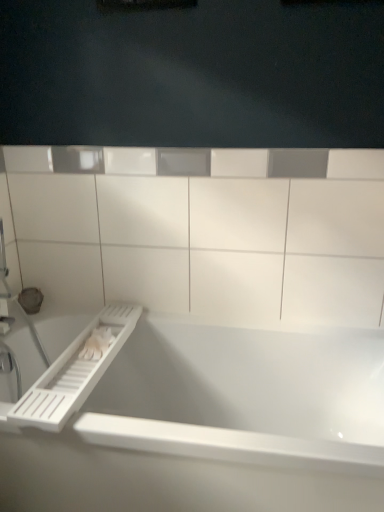
Question: Does white glossy bathtub at center turn towards white plastic ledge at upper center?

Choices:
 (A) no
 (B) yes

Answer: (A)

Question: Is white glossy bathtub at center turned away from white plastic ledge at upper center?

Choices:
 (A) yes
 (B) no

Answer: (B)

Question: Considering the relative positions of white glossy bathtub at center and white plastic ledge at upper center in the image provided, is white glossy bathtub at center to the left of white plastic ledge at upper center from the viewer's perspective?

Choices:
 (A) no
 (B) yes

Answer: (B)

Question: Considering the relative positions of white glossy bathtub at center and white plastic ledge at upper center in the image provided, is white glossy bathtub at center behind white plastic ledge at upper center?

Choices:
 (A) yes
 (B) no

Answer: (B)

Question: Considering the relative sizes of white glossy bathtub at center and white plastic ledge at upper center in the image provided, is white glossy bathtub at center smaller than white plastic ledge at upper center?

Choices:
 (A) no
 (B) yes

Answer: (A)

Question: Is white plastic ledge at upper center wider or thinner than white plastic towel bar at lower left?

Choices:
 (A) thin
 (B) wide

Answer: (A)

Question: Considering the positions of point click(x=292, y=229) and point click(x=56, y=410), is point click(x=292, y=229) closer or farther from the camera than point click(x=56, y=410)?

Choices:
 (A) closer
 (B) farther

Answer: (B)

Question: In terms of height, does white plastic ledge at upper center look taller or shorter compared to white plastic towel bar at lower left?

Choices:
 (A) short
 (B) tall

Answer: (B)

Question: Considering the positions of white plastic ledge at upper center and white plastic towel bar at lower left in the image, is white plastic ledge at upper center bigger or smaller than white plastic towel bar at lower left?

Choices:
 (A) big
 (B) small

Answer: (A)

Question: Is white plastic towel bar at lower left wider or thinner than white plastic ledge at upper center?

Choices:
 (A) wide
 (B) thin

Answer: (A)

Question: Is point (74, 365) closer or farther from the camera than point (59, 186)?

Choices:
 (A) farther
 (B) closer

Answer: (B)

Question: Based on their sizes in the image, would you say white plastic towel bar at lower left is bigger or smaller than white plastic ledge at upper center?

Choices:
 (A) small
 (B) big

Answer: (A)

Question: Is white plastic towel bar at lower left in front of or behind white plastic ledge at upper center in the image?

Choices:
 (A) front
 (B) behind

Answer: (A)

Question: Do you think white plastic ledge at upper center is within white glossy bathtub at center, or outside of it?

Choices:
 (A) inside
 (B) outside

Answer: (B)

Question: In terms of height, does white plastic ledge at upper center look taller or shorter compared to white glossy bathtub at center?

Choices:
 (A) tall
 (B) short

Answer: (A)